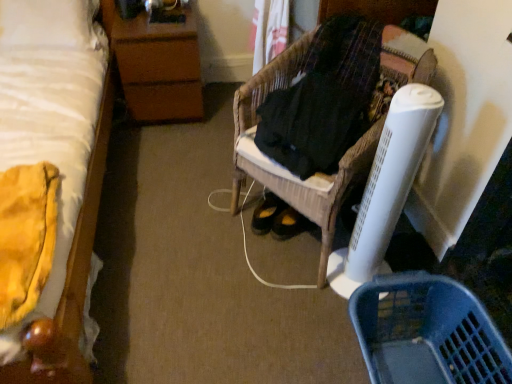
This screenshot has width=512, height=384. In order to click on unoccupied area in front of brown wood nightstand at upper left in this screenshot , I will do `click(165, 145)`.